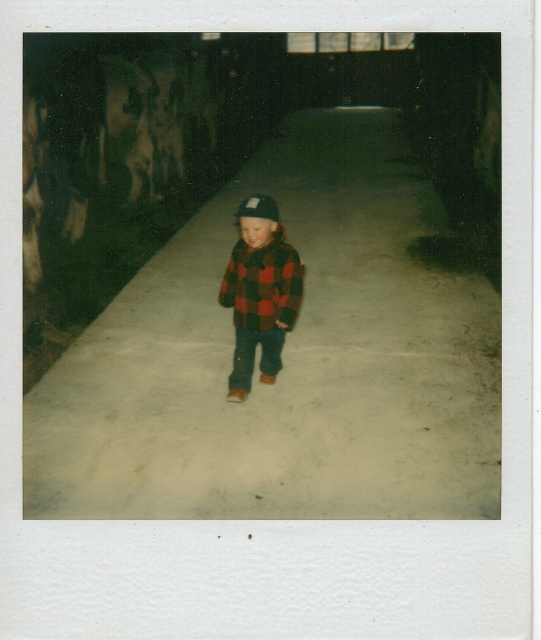
You are a photographer analyzing this Polaroid image. You notice the white concrete pavement at center and the flannel plaid jacket at center. Which object is positioned closer to you in the scene?

The white concrete pavement at center is closer to the viewer than the flannel plaid jacket at center.